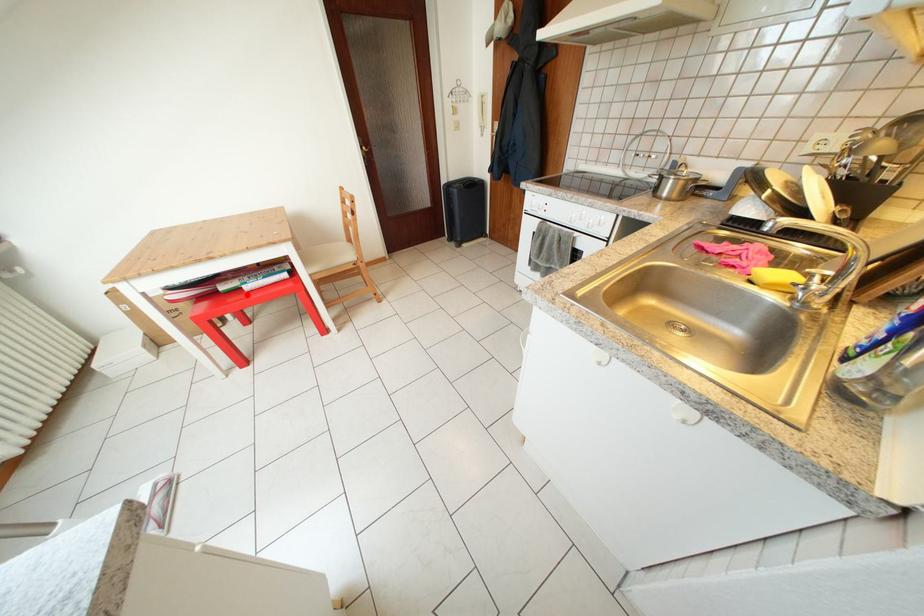
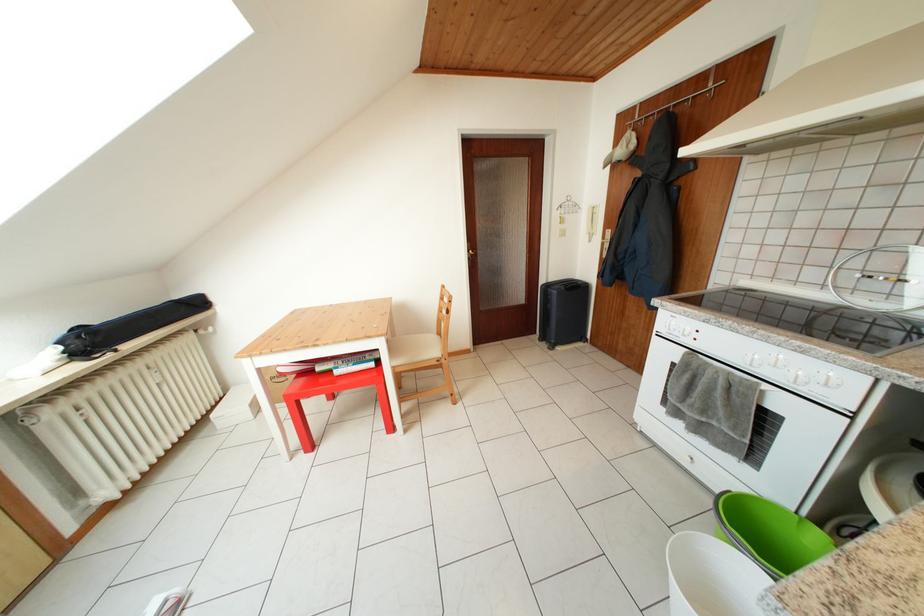
Question: A red point is marked in image1. In image2, is the corresponding 3D point closer to the camera or farther? Reply with the corresponding letter.

Choices:
 (A) The corresponding 3D point is closer.
 (B) The corresponding 3D point is farther.

Answer: (B)